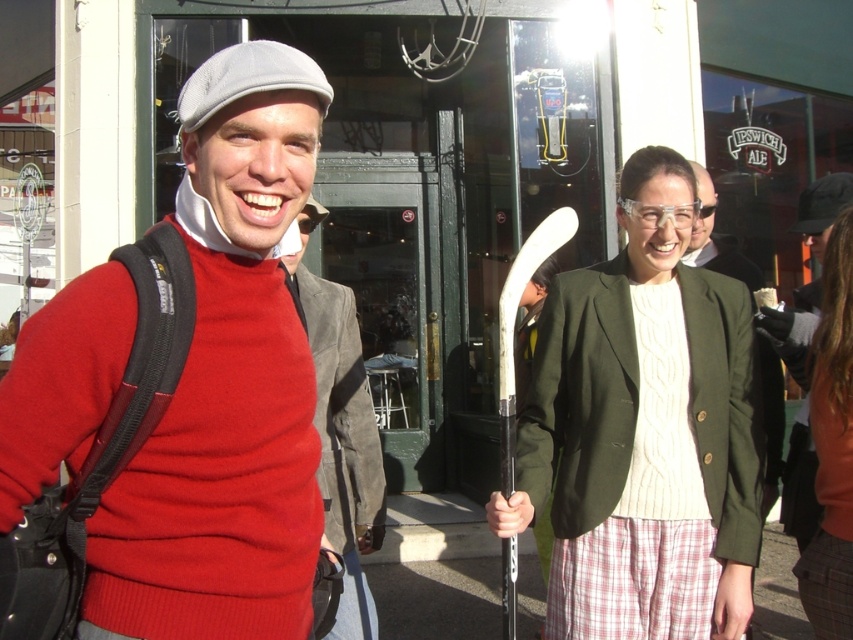
You are standing in front of the Ipswich Ale storefront. There is a point at coordinates (x=183, y=388). What object is located at this point?

The point at coordinates (x=183, y=388) corresponds to the matte red sweater at center.